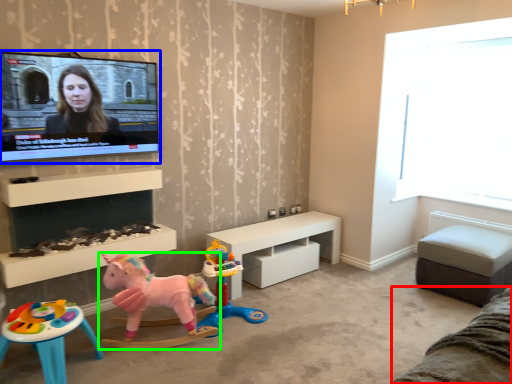
Question: Based on their relative distances, which object is nearer to couch (highlighted by a red box)? Choose from television (highlighted by a blue box) and toy (highlighted by a green box).

Choices:
 (A) television
 (B) toy

Answer: (B)